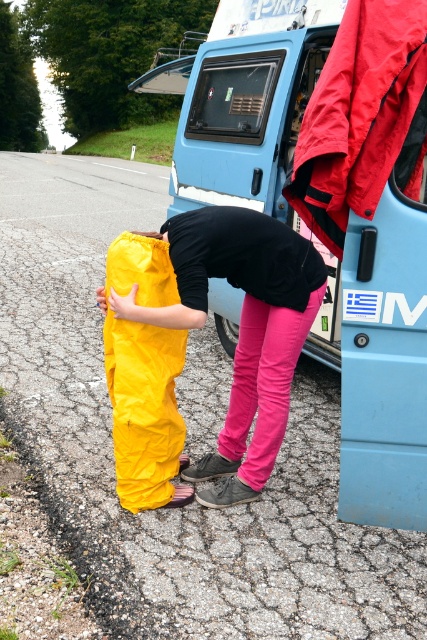
Is blue matte van at center taller than yellow waterproof pants at center?

Correct, blue matte van at center is much taller as yellow waterproof pants at center.

Does point (394, 401) come in front of point (177, 308)?

Yes.

Locate an element on the screen. Image resolution: width=427 pixels, height=640 pixels. blue matte van at center is located at coordinates (379, 358).

Between point (242, 230) and point (140, 484), which one is positioned in front?

Point (242, 230) is more forward.

Is yellow waterproof pants at center positioned before yellow waterproof pants at lower left?

Yes.

Which is behind, point (268, 232) or point (136, 449)?

Point (136, 449)

The height and width of the screenshot is (640, 427). Find the location of `yellow waterproof pants at center`. yellow waterproof pants at center is located at coordinates (242, 328).

Between point (228, 349) and point (178, 461), which one is positioned behind?

The point (228, 349) is behind.

What do you see at coordinates (379, 358) in the screenshot? This screenshot has height=640, width=427. I see `blue matte van at center` at bounding box center [379, 358].

Which is in front, point (251, 168) or point (139, 451)?

Positioned in front is point (139, 451).

You are a GUI agent. You are given a task and a screenshot of the screen. Output one action in this format:
    pyautogui.click(x=<x>, y=<y>)
    Task: Click on the blue matte van at center
    Image resolution: width=427 pixels, height=640 pixels.
    Given the screenshot: What is the action you would take?
    pyautogui.click(x=379, y=358)